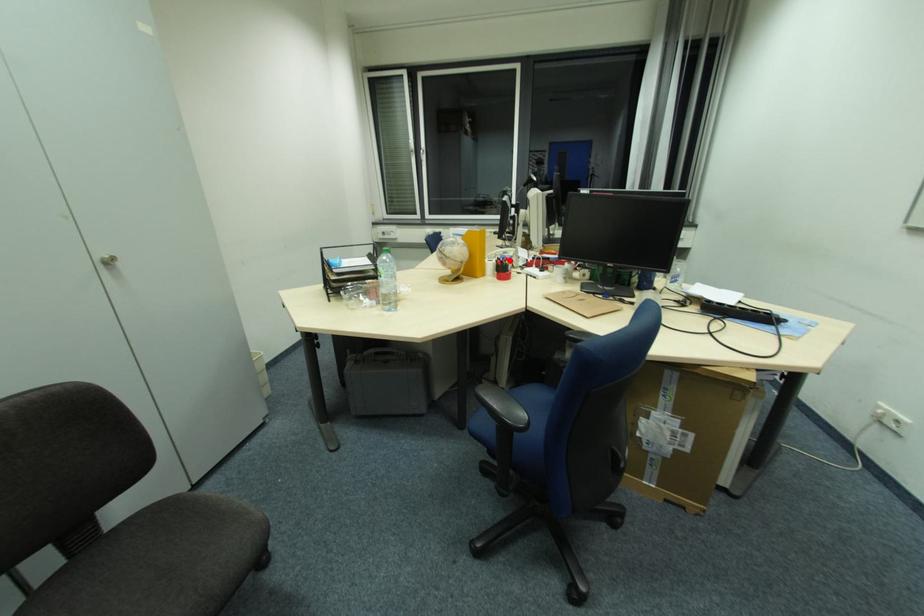
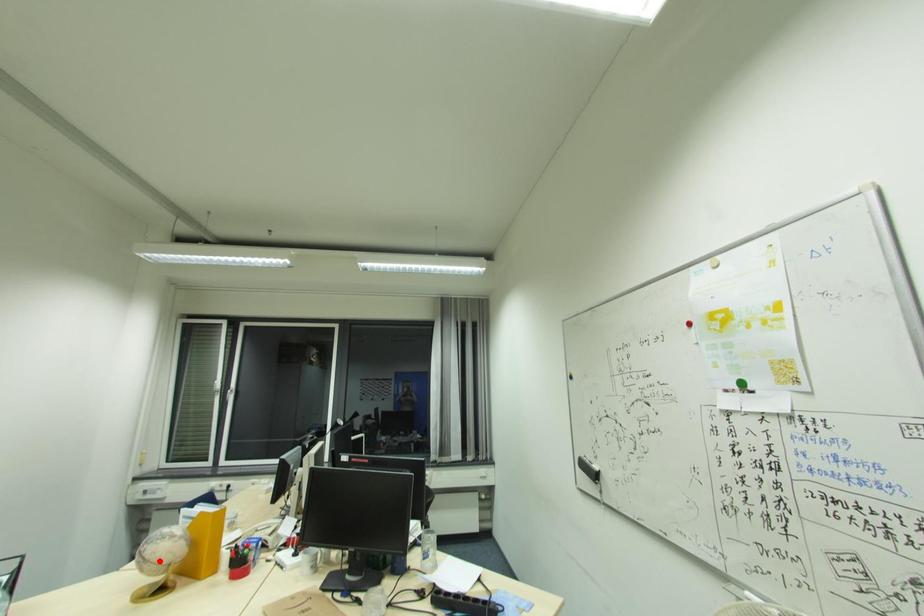
I am providing you with two images of the same scene from different viewpoints. A red point is marked on the first image and another point is marked on the second image. Are the points marked in image1 and image2 representing the same 3D position?

No